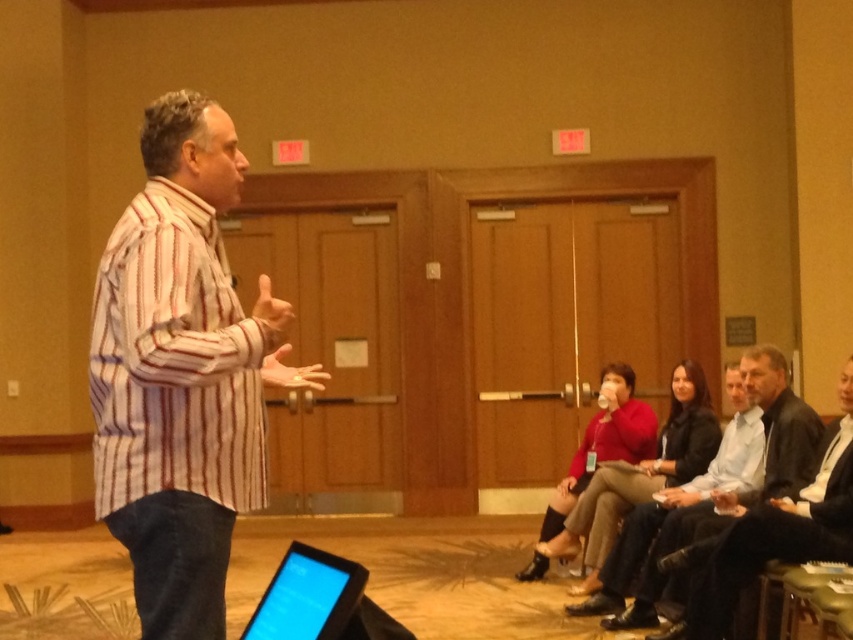
Question: Does dark gray leather jacket at lower right have a larger size compared to red matte sweater at center?

Choices:
 (A) yes
 (B) no

Answer: (A)

Question: Among these points, which one is nearest to the camera?

Choices:
 (A) (273, 602)
 (B) (701, 476)

Answer: (A)

Question: Does dark gray leather jacket at lower right appear under light blue shirt at center?

Choices:
 (A) yes
 (B) no

Answer: (B)

Question: Which object is the farthest from the dark gray leather jacket at lower right?

Choices:
 (A) red matte sweater at center
 (B) black glossy laptop at lower left
 (C) striped cotton shirt at left

Answer: (C)

Question: Is dark gray leather jacket at lower right positioned at the back of light blue shirt at center?

Choices:
 (A) yes
 (B) no

Answer: (B)

Question: Estimate the real-world distances between objects in this image. Which object is farther from the light blue shirt at center?

Choices:
 (A) black glossy laptop at lower left
 (B) striped cotton shirt at left
 (C) red matte sweater at center
 (D) dark gray leather jacket at lower right

Answer: (B)